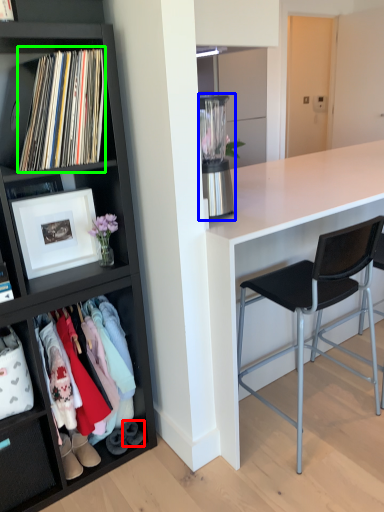
Question: Estimate the real-world distances between objects in this image. Which object is farther from shoe (highlighted by a red box), appliance (highlighted by a blue box) or book (highlighted by a green box)?

Choices:
 (A) appliance
 (B) book

Answer: (B)